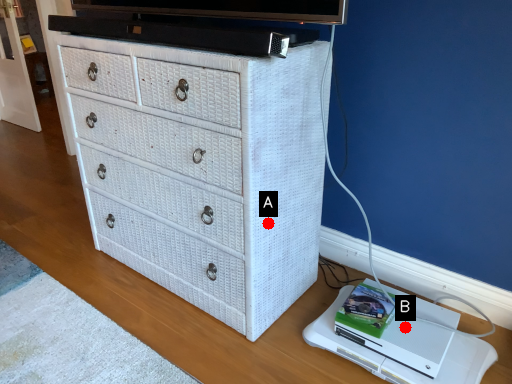
Question: Two points are circled on the image, labeled by A and B beside each circle. Which of the following is the farthest from the observer?

Choices:
 (A) A is further
 (B) B is further

Answer: (B)